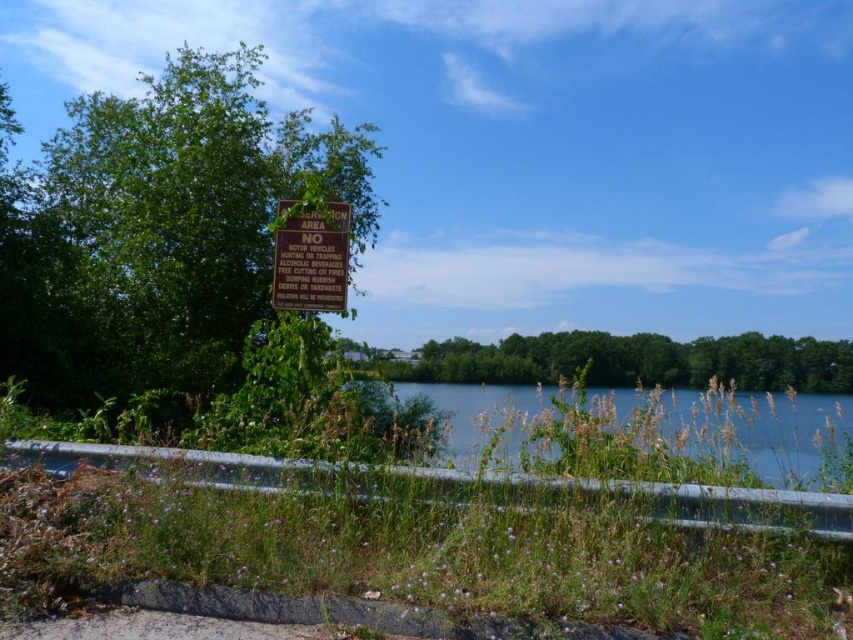
You are a hiker who wants to take a photo of the clear water at center. To ensure the green leafy tree at upper left doesn not block the view, should you move forward or backward?

The green leafy tree at upper left is located above the clear water at center. To avoid the tree blocking the view of the clear water at center, you should move forward, as moving closer would reduce the tree appearing in front of the water in the frame.

You are standing at the point closest to the guardrail. Which of the two points, point (395, 388) or point (334, 205), is farther away from you?

Point (395, 388) is farther away from you because it is behind point (334, 205).